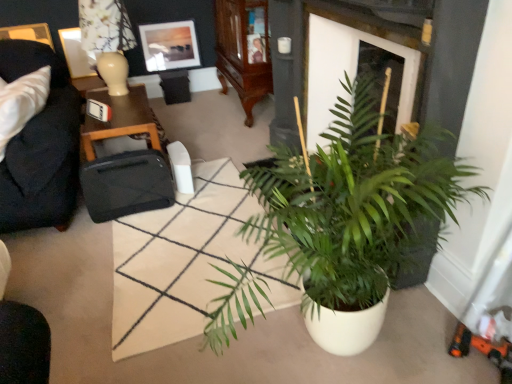
Question: Considering the relative sizes of dark blue fabric couch at left and green matte plant at center in the image provided, is dark blue fabric couch at left bigger than green matte plant at center?

Choices:
 (A) no
 (B) yes

Answer: (A)

Question: Is dark blue fabric couch at left oriented towards green matte plant at center?

Choices:
 (A) yes
 (B) no

Answer: (B)

Question: From the image's perspective, would you say dark blue fabric couch at left is shown under green matte plant at center?

Choices:
 (A) no
 (B) yes

Answer: (A)

Question: Is dark blue fabric couch at left outside of green matte plant at center?

Choices:
 (A) yes
 (B) no

Answer: (A)

Question: From a real-world perspective, is dark blue fabric couch at left under green matte plant at center?

Choices:
 (A) no
 (B) yes

Answer: (A)

Question: Is dark blue fabric couch at left bigger or smaller than green matte plant at center?

Choices:
 (A) small
 (B) big

Answer: (A)

Question: Does point (24, 225) appear closer or farther from the camera than point (289, 261)?

Choices:
 (A) farther
 (B) closer

Answer: (A)

Question: Considering the positions of dark blue fabric couch at left and green matte plant at center in the image, is dark blue fabric couch at left taller or shorter than green matte plant at center?

Choices:
 (A) tall
 (B) short

Answer: (B)

Question: Would you say dark blue fabric couch at left is inside or outside green matte plant at center?

Choices:
 (A) inside
 (B) outside

Answer: (B)

Question: From a real-world perspective, is white ceramic lamp at upper left positioned above or below wooden cabinet at upper center?

Choices:
 (A) above
 (B) below

Answer: (A)

Question: Is white ceramic lamp at upper left in front of or behind wooden cabinet at upper center in the image?

Choices:
 (A) front
 (B) behind

Answer: (A)

Question: In terms of width, does white ceramic lamp at upper left look wider or thinner when compared to wooden cabinet at upper center?

Choices:
 (A) thin
 (B) wide

Answer: (A)

Question: Considering the positions of point (120, 69) and point (244, 1), is point (120, 69) closer or farther from the camera than point (244, 1)?

Choices:
 (A) closer
 (B) farther

Answer: (A)

Question: From their relative heights in the image, would you say white glossy picture frame at upper left, the 1th picture frame in the left-to-right sequence, is taller or shorter than black matte suitcase at center?

Choices:
 (A) short
 (B) tall

Answer: (B)

Question: Is point 75,34 closer or farther from the camera than point 160,180?

Choices:
 (A) closer
 (B) farther

Answer: (B)